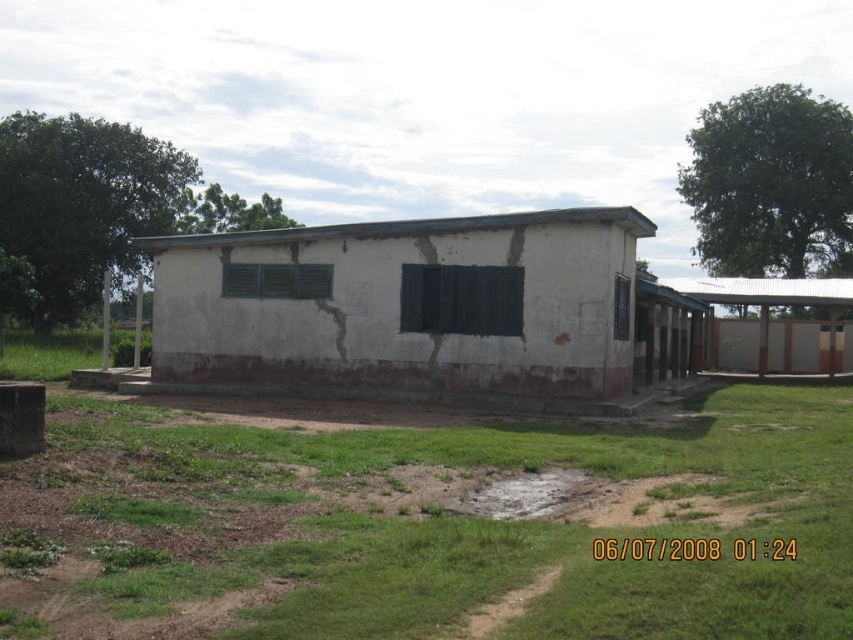
Question: From the image, what is the correct spatial relationship of green grass at lower center in relation to metal corrugated roof at right?

Choices:
 (A) below
 (B) above

Answer: (A)

Question: Where is white matte building at center located in relation to metal corrugated roof at right in the image?

Choices:
 (A) above
 (B) below

Answer: (B)

Question: Is green grass at lower center closer to camera compared to metal corrugated roof at right?

Choices:
 (A) yes
 (B) no

Answer: (A)

Question: Which point is closer to the camera?

Choices:
 (A) (422, 221)
 (B) (143, 580)

Answer: (B)

Question: Among these objects, which one is nearest to the camera?

Choices:
 (A) metal corrugated roof at right
 (B) green grass at lower center

Answer: (B)

Question: Which object is farther from the camera taking this photo?

Choices:
 (A) green grass at lower center
 (B) white matte building at center

Answer: (B)